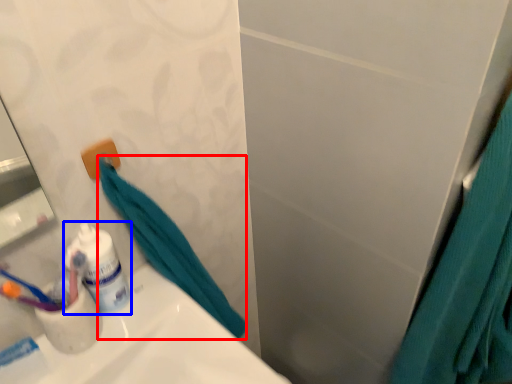
Question: Which point is further to the camera, bath towel (highlighted by a red box) or toiletry (highlighted by a blue box)?

Choices:
 (A) bath towel
 (B) toiletry

Answer: (B)